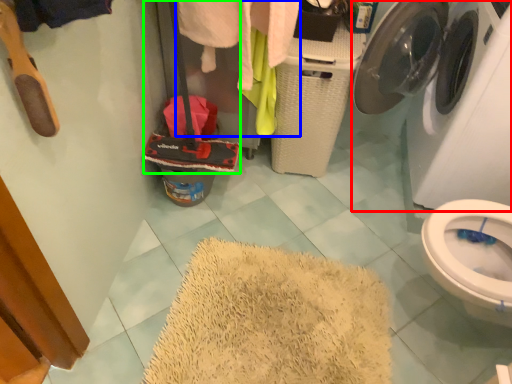
Question: Estimate the real-world distances between objects in this image. Which object is closer to washing machine (highlighted by a red box), clothing (highlighted by a blue box) or luggage (highlighted by a green box)?

Choices:
 (A) clothing
 (B) luggage

Answer: (A)